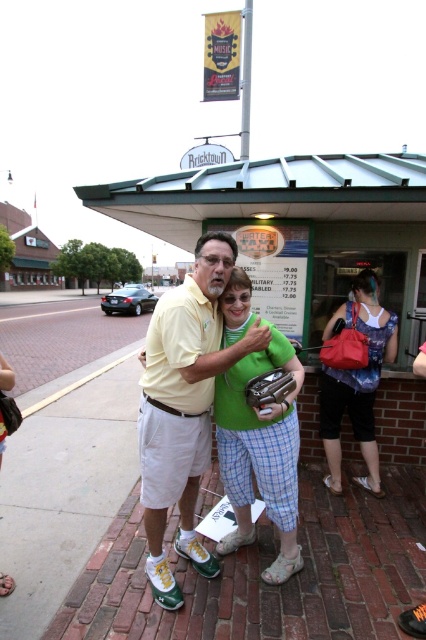
Question: Is green fabric purse at center to the right of matte blue dress at center from the viewer's perspective?

Choices:
 (A) yes
 (B) no

Answer: (B)

Question: Does yellow cotton shirt at center appear under green fabric purse at center?

Choices:
 (A) yes
 (B) no

Answer: (B)

Question: Which object appears farthest from the camera in this image?

Choices:
 (A) matte blue dress at center
 (B) green fabric purse at center

Answer: (A)

Question: Which is nearer to the yellow cotton shirt at center?

Choices:
 (A) matte blue dress at center
 (B) green fabric purse at center

Answer: (B)

Question: Which of the following is the farthest from the observer?

Choices:
 (A) yellow cotton shirt at center
 (B) matte blue dress at center

Answer: (B)

Question: In this image, where is green fabric purse at center located relative to matte blue dress at center?

Choices:
 (A) above
 (B) below

Answer: (B)